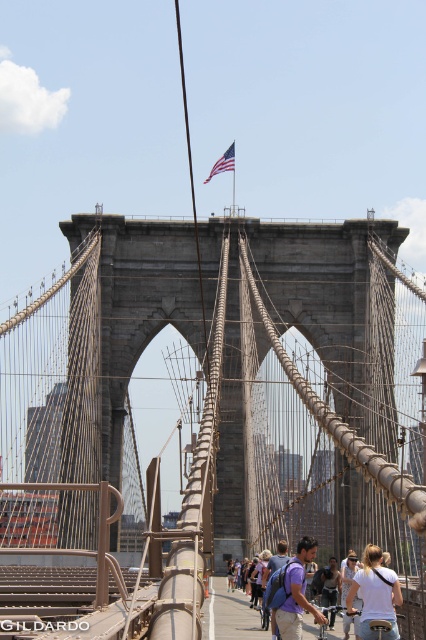
Between point (327, 592) and point (233, 161), which one is positioned behind?

Point (233, 161)

Between denim jacket at center and american flag at upper center, which one is positioned higher?

american flag at upper center is above.

Is point (336, 580) positioned before point (213, 172)?

Yes, point (336, 580) is in front of point (213, 172).

Image resolution: width=426 pixels, height=640 pixels. Find the location of `denim jacket at center`. denim jacket at center is located at coordinates (330, 582).

Which is in front, point (314, 611) or point (321, 579)?

Positioned in front is point (314, 611).

Is matte purple backpack at center above denim jacket at center?

Yes, matte purple backpack at center is above denim jacket at center.

Is point (279, 611) farther from camera compared to point (328, 582)?

No.

Identify the location of matte purple backpack at center. point(296,593).

Is white fabric backpack at center smaller than american flag at upper center?

Actually, white fabric backpack at center might be larger than american flag at upper center.

Is point (265, 632) closer to camera compared to point (224, 161)?

Yes, it is.

This screenshot has width=426, height=640. What are the coordinates of `white fabric backpack at center` in the screenshot? It's located at (230, 614).

I want to click on white fabric backpack at center, so click(x=230, y=614).